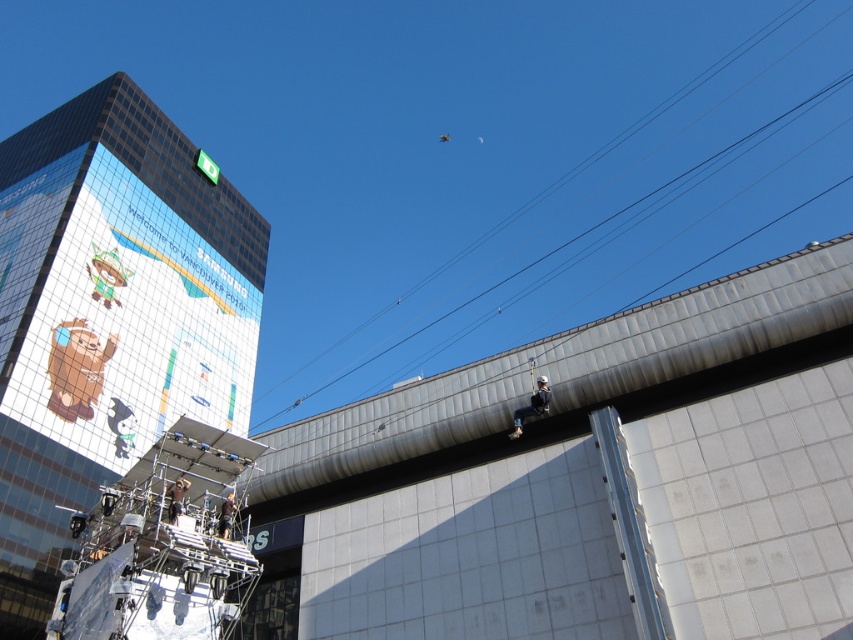
Does reflective glass billboard at upper left appear on the right side of dark gray fabric helmet at upper right?

In fact, reflective glass billboard at upper left is to the left of dark gray fabric helmet at upper right.

Which is above, reflective glass billboard at upper left or dark gray fabric helmet at upper right?

reflective glass billboard at upper left

Which is behind, point (80, 385) or point (527, 412)?

Positioned behind is point (80, 385).

Image resolution: width=853 pixels, height=640 pixels. Find the location of `reflective glass billboard at upper left`. reflective glass billboard at upper left is located at coordinates (119, 314).

Does dark gray fabric helmet at upper right appear over dark brown leather jacket at lower center?

Yes.

Between dark gray fabric helmet at upper right and dark brown leather jacket at lower center, which one appears on the left side from the viewer's perspective?

Positioned to the left is dark brown leather jacket at lower center.

Locate an element on the screen. The height and width of the screenshot is (640, 853). dark gray fabric helmet at upper right is located at coordinates [531, 406].

Find the location of a particular element. dark gray fabric helmet at upper right is located at coordinates (531, 406).

Is point (815, 96) positioned behind point (544, 412)?

Yes, it is behind point (544, 412).

Between point (548, 252) and point (511, 435), which one is positioned behind?

The point (548, 252) is more distant.

What are the coordinates of `black wire at upper center` in the screenshot? It's located at (563, 179).